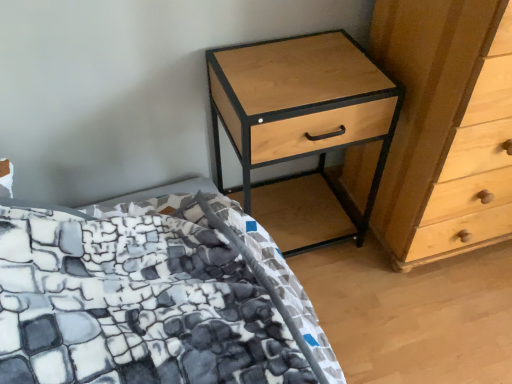
Question: From the image's perspective, is stone-patterned fabric bed at lower left above light wood/black metal nightstand at upper right?

Choices:
 (A) yes
 (B) no

Answer: (B)

Question: Does stone-patterned fabric bed at lower left have a smaller size compared to light wood/black metal nightstand at upper right?

Choices:
 (A) yes
 (B) no

Answer: (A)

Question: Is stone-patterned fabric bed at lower left shorter than light wood/black metal nightstand at upper right?

Choices:
 (A) no
 (B) yes

Answer: (B)

Question: Does stone-patterned fabric bed at lower left have a larger size compared to light wood/black metal nightstand at upper right?

Choices:
 (A) no
 (B) yes

Answer: (A)

Question: Would you say light wood/black metal nightstand at upper right is part of stone-patterned fabric bed at lower left's contents?

Choices:
 (A) no
 (B) yes

Answer: (A)

Question: From the image's perspective, is light wood/black metal nightstand at upper right positioned above or below light wood/texture chest of drawers at right?

Choices:
 (A) above
 (B) below

Answer: (B)

Question: In terms of size, does light wood/black metal nightstand at upper right appear bigger or smaller than light wood/texture chest of drawers at right?

Choices:
 (A) big
 (B) small

Answer: (B)

Question: Relative to light wood/texture chest of drawers at right, is light wood/black metal nightstand at upper right in front or behind?

Choices:
 (A) front
 (B) behind

Answer: (B)

Question: Is light wood/black metal nightstand at upper right taller or shorter than light wood/texture chest of drawers at right?

Choices:
 (A) tall
 (B) short

Answer: (B)

Question: Is light wood/black metal nightstand at upper right bigger or smaller than stone-patterned fabric bed at lower left?

Choices:
 (A) small
 (B) big

Answer: (B)

Question: From their relative heights in the image, would you say light wood/black metal nightstand at upper right is taller or shorter than stone-patterned fabric bed at lower left?

Choices:
 (A) tall
 (B) short

Answer: (A)

Question: From a real-world perspective, is light wood/black metal nightstand at upper right physically located above or below stone-patterned fabric bed at lower left?

Choices:
 (A) above
 (B) below

Answer: (A)

Question: Looking at their shapes, would you say light wood/black metal nightstand at upper right is wider or thinner than stone-patterned fabric bed at lower left?

Choices:
 (A) thin
 (B) wide

Answer: (A)

Question: Choose the correct answer: Is light wood/texture chest of drawers at right inside light wood/black metal nightstand at upper right or outside it?

Choices:
 (A) outside
 (B) inside

Answer: (A)

Question: From their relative heights in the image, would you say light wood/texture chest of drawers at right is taller or shorter than light wood/black metal nightstand at upper right?

Choices:
 (A) short
 (B) tall

Answer: (B)